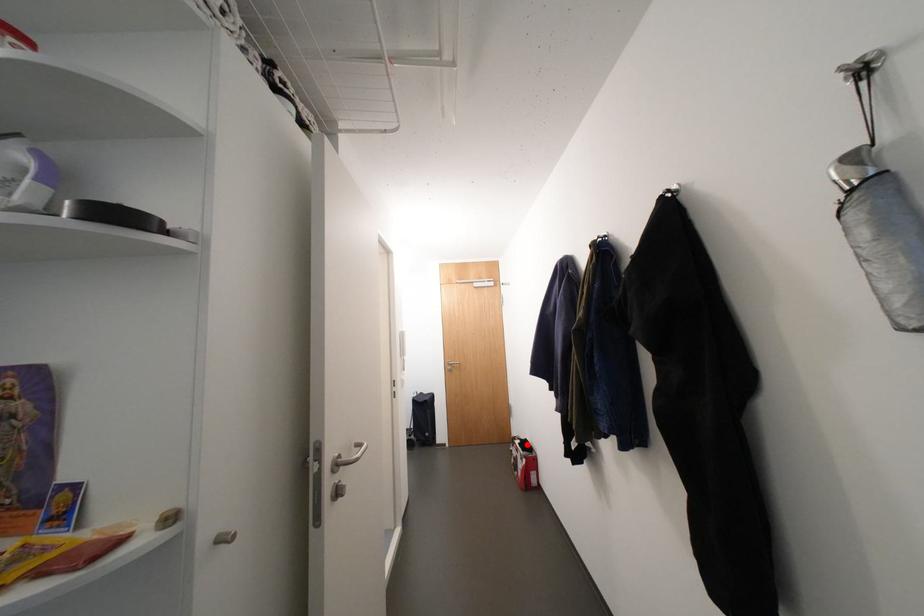
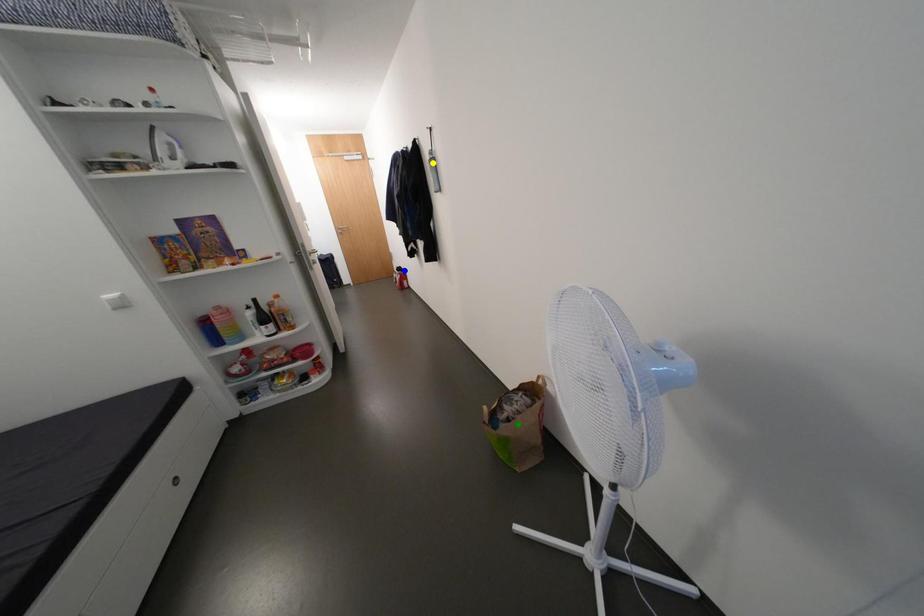
Question: I am providing you with two images of the same scene from different viewpoints. A red point is marked on the first image. You are given multiple points on the second image. Which point in image 2 is actually the same real-world point as the red point in image 1?

Choices:
 (A) yellow point
 (B) green point
 (C) blue point

Answer: (C)